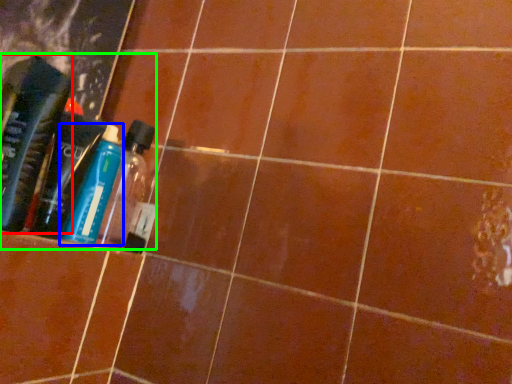
Question: Considering the real-world distances, which object is farthest from bottle (highlighted by a red box)? bottle (highlighted by a blue box) or product (highlighted by a green box)?

Choices:
 (A) bottle
 (B) product

Answer: (A)